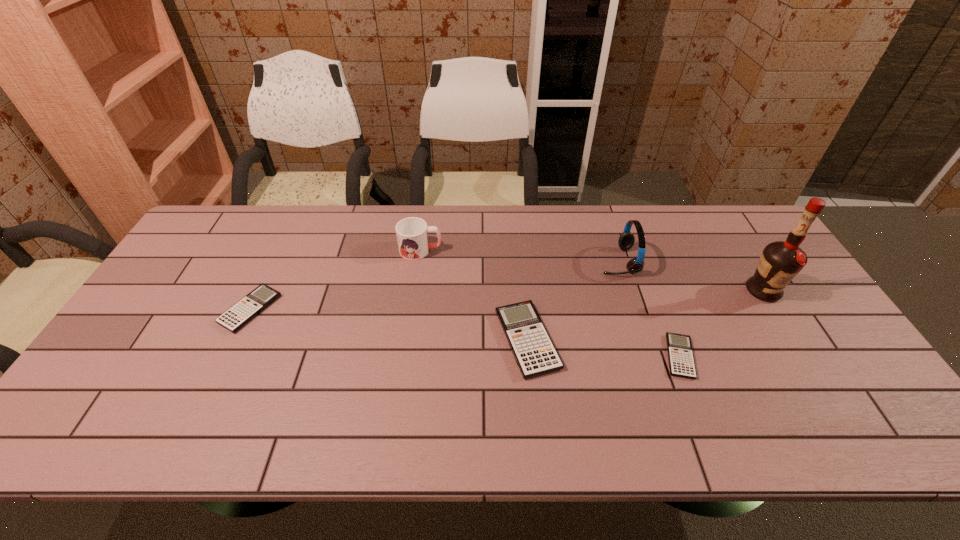
You are a GUI agent. You are given a task and a screenshot of the screen. Output one action in this format:
    pyautogui.click(x=<x>, y=<y>)
    Task: Click on the unoccupied area between the fourth object from right to left and the fifth tallest object
    
    Given the screenshot: What is the action you would take?
    pyautogui.click(x=389, y=325)

Locate an element on the screen. vacant space that is in between the shortest object and the third shortest object is located at coordinates (604, 348).

The image size is (960, 540). Identify the location of empty location between the mug and the shortest calculator. [x=550, y=303].

This screenshot has width=960, height=540. Identify the location of vacant region between the second tallest object and the fourth shortest object. (519, 255).

This screenshot has height=540, width=960. Find the location of `vacant area that lies between the leftmost object and the shortest calculator`. vacant area that lies between the leftmost object and the shortest calculator is located at coordinates (465, 333).

You are a GUI agent. You are given a task and a screenshot of the screen. Output one action in this format:
    pyautogui.click(x=<x>, y=<y>)
    Task: Click on the empty space that is in between the headset and the shortest object
    This screenshot has height=540, width=960.
    Given the screenshot: What is the action you would take?
    pyautogui.click(x=649, y=309)

The width and height of the screenshot is (960, 540). I want to click on object that stands as the closest to the leftmost object, so click(412, 233).

Find the location of `object that ranks as the closest to the headset`. object that ranks as the closest to the headset is located at coordinates (534, 352).

Locate which calculator is the closest to the third object from left to right. Please provide its 2D coordinates. Your answer should be formatted as a tuple, i.e. [(x, y)], where the tuple contains the x and y coordinates of a point satisfying the conditions above.

[(680, 353)]

Identify the location of calculator that can be found as the closest to the third object from left to right. Image resolution: width=960 pixels, height=540 pixels. (680, 353).